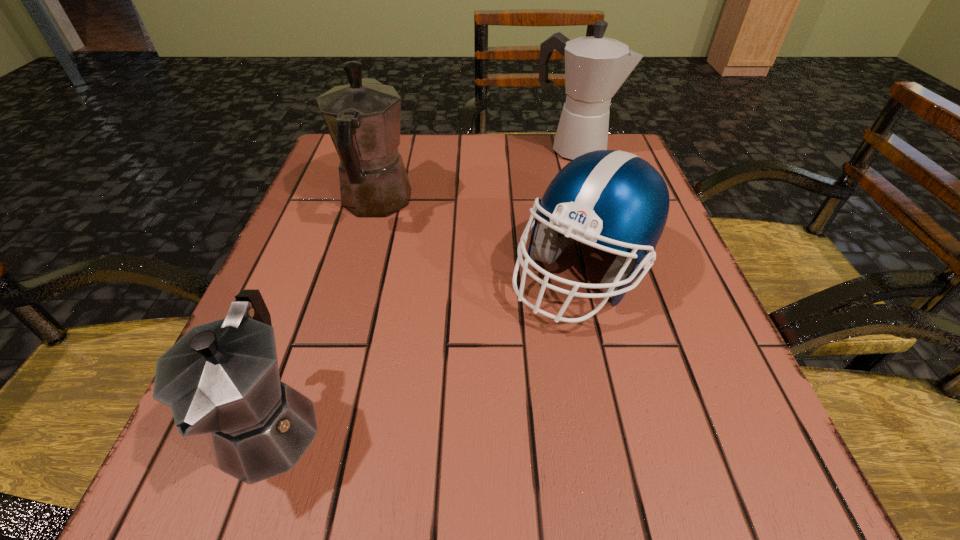
The image size is (960, 540). I want to click on the farthest coffeepot, so click(595, 67).

Find the location of a particular element. This screenshot has width=960, height=540. the rightmost coffeepot is located at coordinates (595, 67).

In order to click on the second nearest coffeepot in this screenshot , I will do `click(363, 118)`.

You are a GUI agent. You are given a task and a screenshot of the screen. Output one action in this format:
    pyautogui.click(x=<x>, y=<y>)
    Task: Click on the football helmet
    The width and height of the screenshot is (960, 540).
    Given the screenshot: What is the action you would take?
    tap(614, 198)

The height and width of the screenshot is (540, 960). In order to click on the nearest coffeepot in this screenshot , I will do `click(222, 377)`.

Identify the location of the nearest object. (222, 377).

Identify the location of free space located 0.200m on the front of the farthest coffeepot. The width and height of the screenshot is (960, 540). [x=593, y=215].

Locate an element on the screen. vacant area situated on the pouring side of the second nearest coffeepot is located at coordinates (394, 141).

This screenshot has width=960, height=540. Identify the location of vacant region located at the front of the football helmet with the faceguard. (606, 375).

This screenshot has height=540, width=960. In order to click on object at the near edge in this screenshot , I will do `click(222, 377)`.